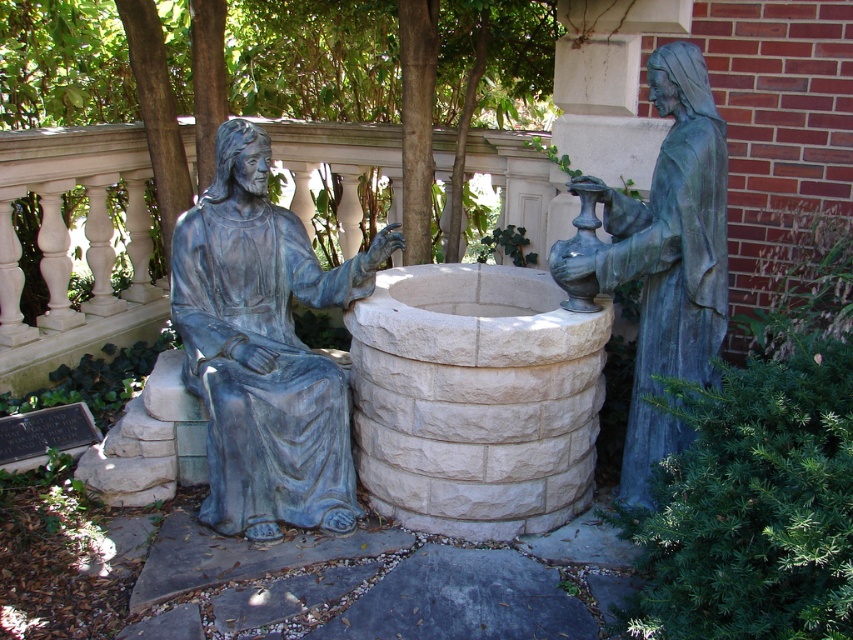
Based on the photo, you are an art curator planning to move the blue patina statue at left and the bronze statue at right to a new gallery. The gallery has a 1.8 meter wide entrance. Considering their sizes, which statue will require more careful handling to ensure it fits through the entrance?

The blue patina statue at left is bigger than the bronze statue at right, so it will require more careful handling to ensure it fits through the 1.8 meter wide entrance.

You are a visitor standing in front of the well and want to take a photo of both the blue patina statue at left and the bronze statue at right. Which statue should you move closer to in order to include both in the frame without cropping either?

You should move closer to the blue patina statue at left because the bronze statue at right is behind it, so moving forward will keep both statues within the camera frame without cropping.